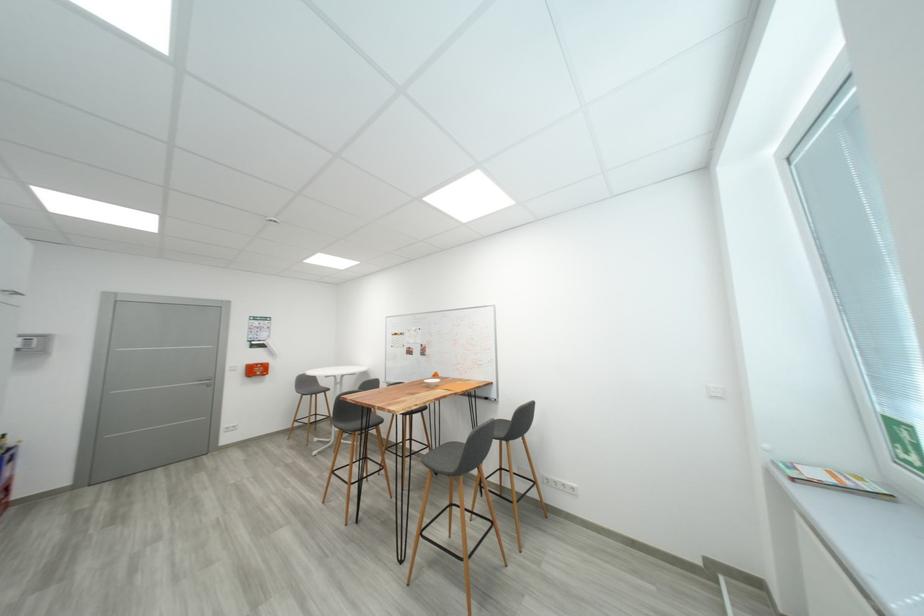
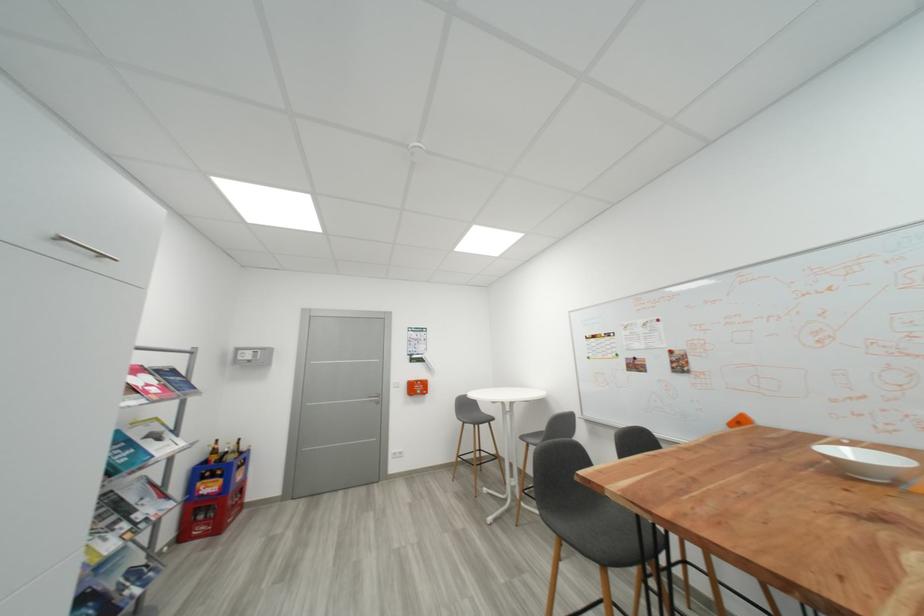
The point at (349, 434) is marked in the first image. Where is the corresponding point in the second image?

(568, 539)